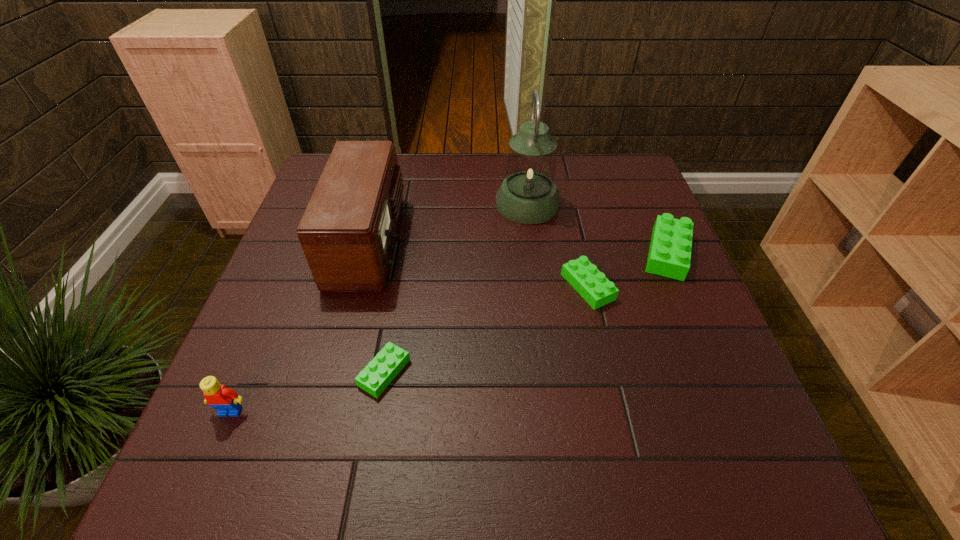
The image size is (960, 540). What are the coordinates of `vacant area that satisfies the following two spatial constraints: 1. on the front-facing side of the fifth shortest object; 2. on the back side of the second Lego from left to right` in the screenshot? It's located at (335, 373).

Find the location of `vacant space that satisfies the following two spatial constraints: 1. on the front-facing side of the fifth shortest object; 2. on the right side of the second Lego from right to left`. vacant space that satisfies the following two spatial constraints: 1. on the front-facing side of the fifth shortest object; 2. on the right side of the second Lego from right to left is located at coordinates (357, 287).

You are a GUI agent. You are given a task and a screenshot of the screen. Output one action in this format:
    pyautogui.click(x=<x>, y=<y>)
    Task: Click on the free space that satisfies the following two spatial constraints: 1. on the front-facing side of the second tallest object; 2. on the back side of the second Lego from right to left
    This screenshot has height=540, width=960.
    Given the screenshot: What is the action you would take?
    pyautogui.click(x=357, y=287)

The image size is (960, 540). In order to click on free space that satisfies the following two spatial constraints: 1. on the front-facing side of the second tallest object; 2. on the right side of the second shortest Lego in this screenshot , I will do `click(357, 287)`.